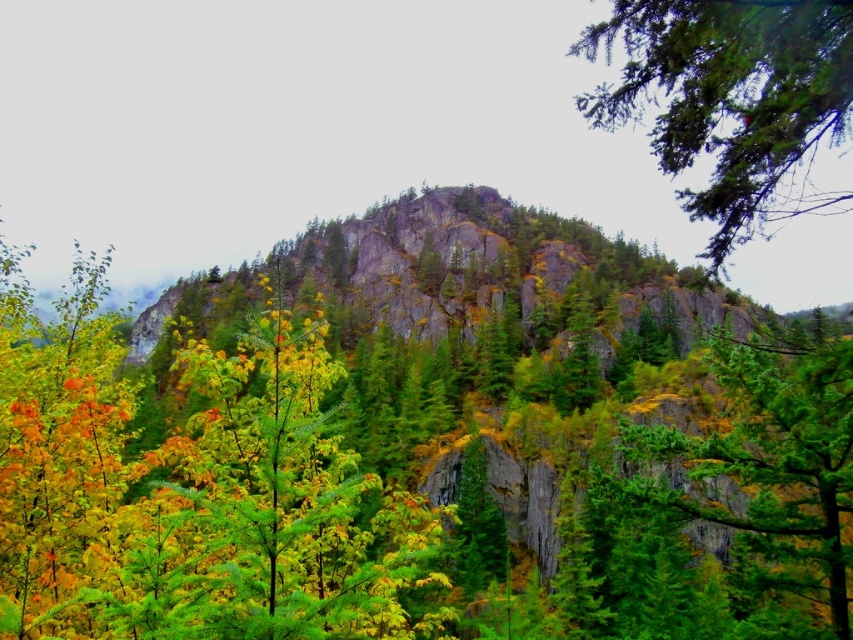
Question: Observing the image, what is the correct spatial positioning of green textured branch at upper right in reference to green textured rock at right?

Choices:
 (A) right
 (B) left

Answer: (A)

Question: Does green textured branch at upper right lie in front of green textured rock at right?

Choices:
 (A) yes
 (B) no

Answer: (A)

Question: Does green textured branch at upper right appear over green textured rock at right?

Choices:
 (A) yes
 (B) no

Answer: (A)